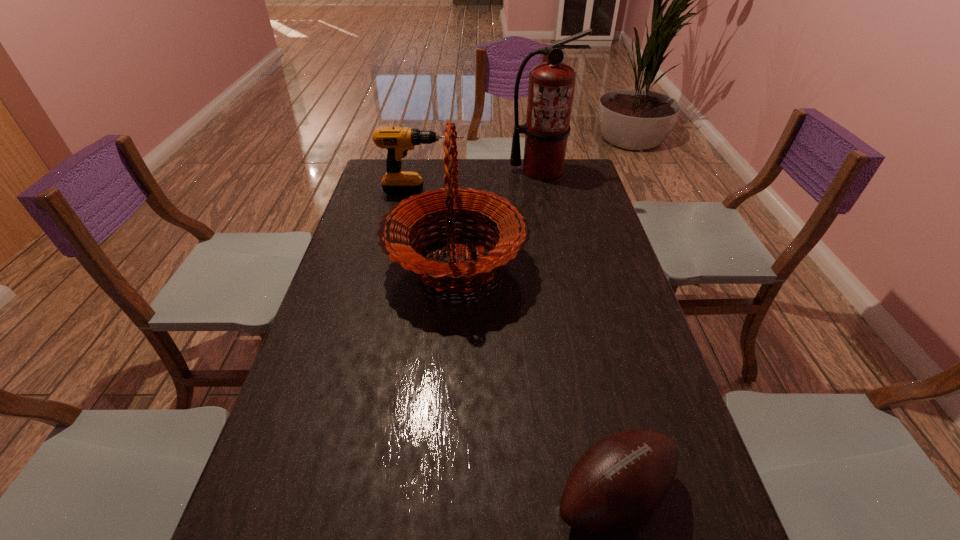
You are a GUI agent. You are given a task and a screenshot of the screen. Output one action in this format:
    pyautogui.click(x=<x>, y=<y>)
    Task: Click on the fire extinguisher
    This screenshot has width=960, height=540.
    Given the screenshot: What is the action you would take?
    pyautogui.click(x=551, y=84)

The image size is (960, 540). Find the location of `the tallest object`. the tallest object is located at coordinates (551, 84).

What are the coordinates of `the second tallest object` in the screenshot? It's located at (510, 227).

Identify the location of basket. (510, 227).

The width and height of the screenshot is (960, 540). I want to click on the second farthest object, so pyautogui.click(x=398, y=141).

Find the location of a particular element. The height and width of the screenshot is (540, 960). drill is located at coordinates (398, 141).

Image resolution: width=960 pixels, height=540 pixels. I want to click on blank area located toward the nozzle of the farthest object, so click(545, 194).

The width and height of the screenshot is (960, 540). I want to click on vacant region located on the left of the basket, so click(340, 265).

Identify the location of free space located at the tip of the third nearest object. (507, 191).

Where is `fire extinguisher at the far edge`? The height and width of the screenshot is (540, 960). fire extinguisher at the far edge is located at coordinates (551, 84).